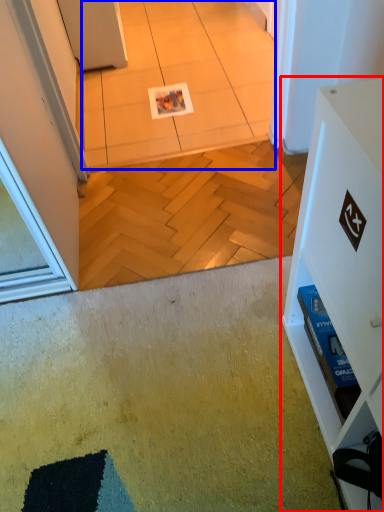
Question: Which object is closer to the camera taking this photo, furniture (highlighted by a red box) or tile (highlighted by a blue box)?

Choices:
 (A) furniture
 (B) tile

Answer: (A)